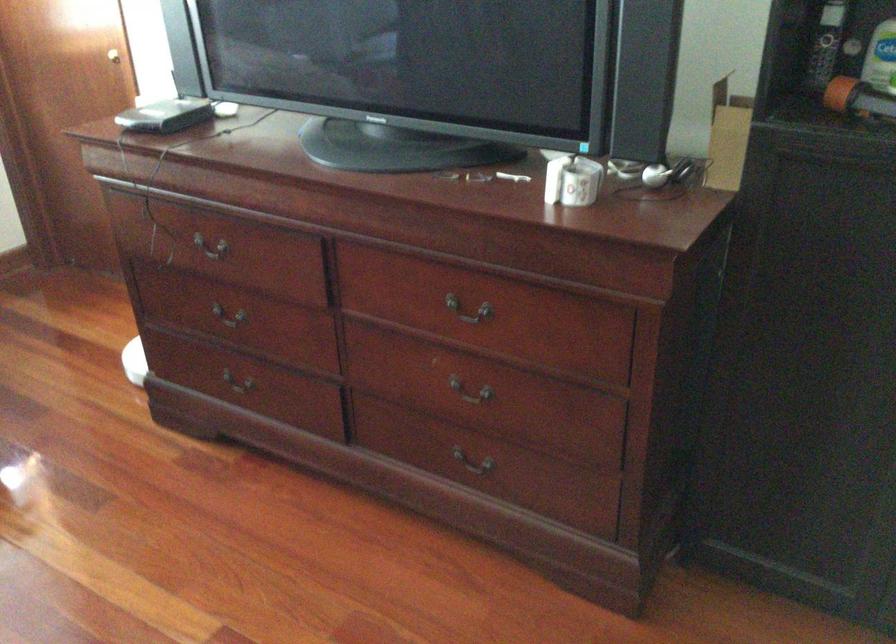
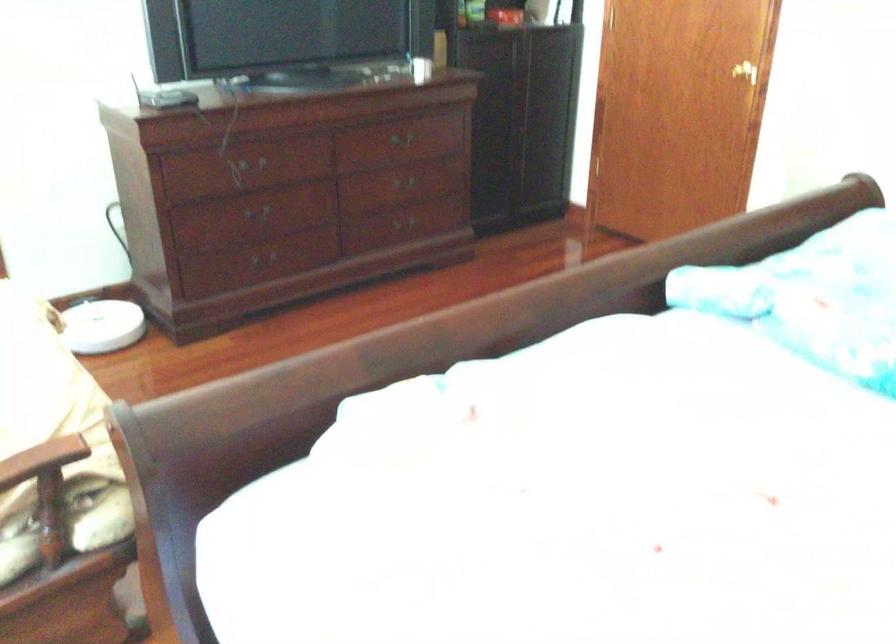
Locate, in the second image, the point that corresponds to the point at 247,325 in the first image.

(255, 210)